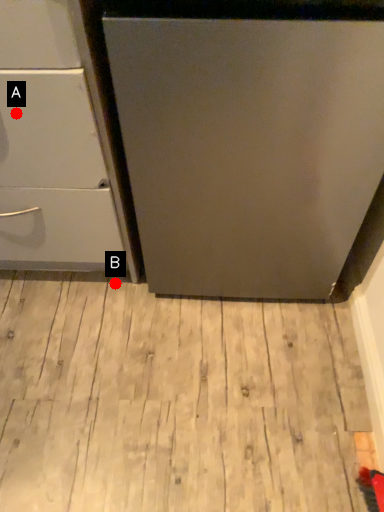
Question: Two points are circled on the image, labeled by A and B beside each circle. Which point is closer to the camera?

Choices:
 (A) A is closer
 (B) B is closer

Answer: (A)